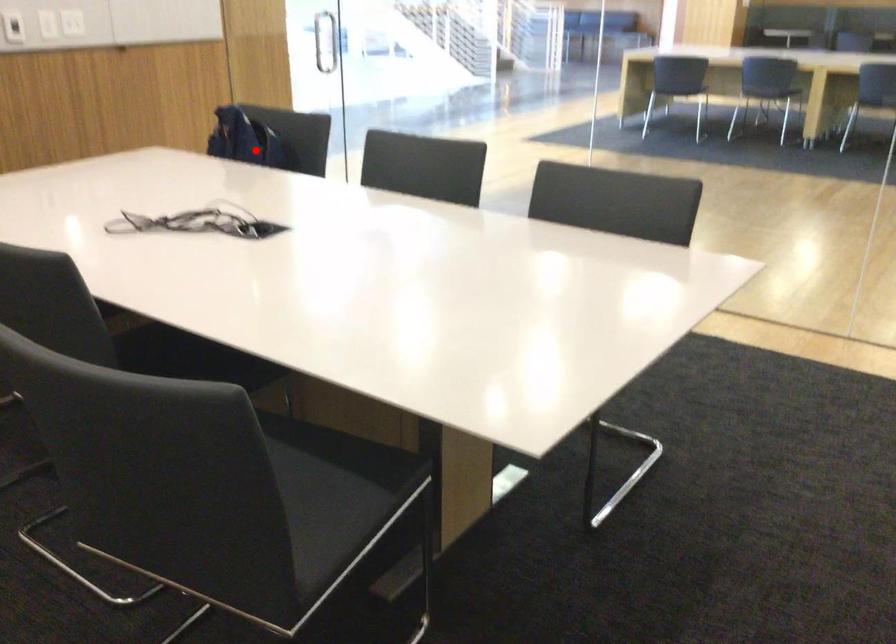
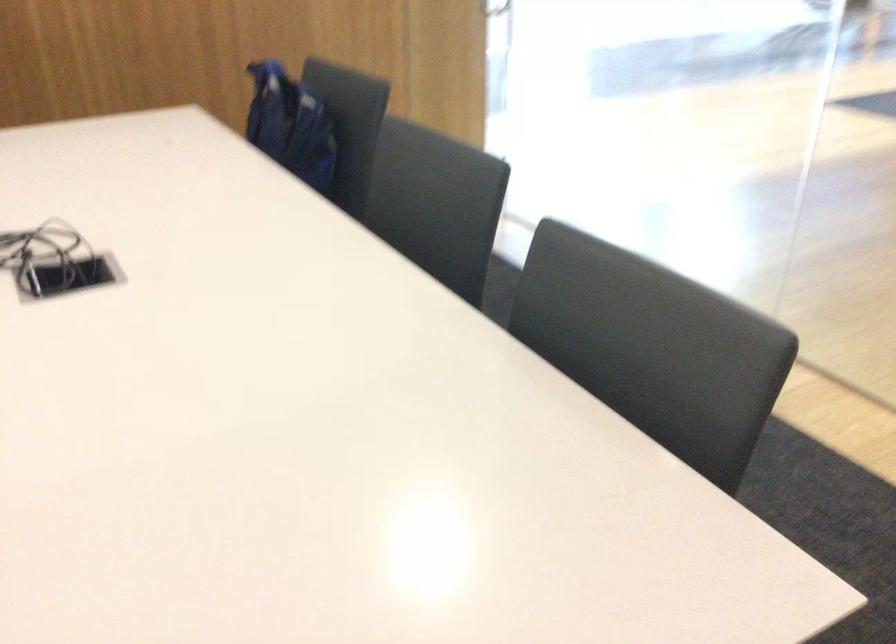
Question: A red point is marked in image1. In image2, is the corresponding 3D point closer to the camera or farther? Reply with the corresponding letter.

Choices:
 (A) The corresponding 3D point is closer.
 (B) The corresponding 3D point is farther.

Answer: (A)